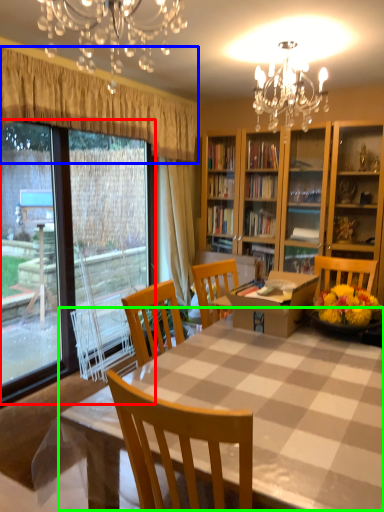
Question: Which object is positioned closest to bay window (highlighted by a red box)? Select from curtain (highlighted by a blue box) and kitchen & dining room table (highlighted by a green box).

Choices:
 (A) curtain
 (B) kitchen & dining room table

Answer: (A)